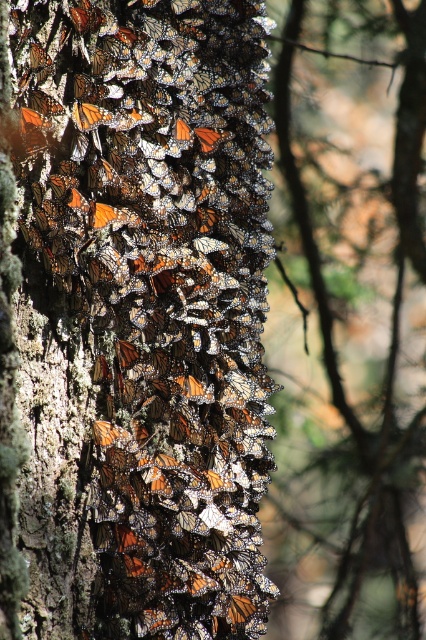
You are observing a cluster of monarch butterflies on a tree trunk. There is a point labeled as point (141,314). Which object corresponds to this point?

The orange and black wings at center corresponds to point (141,314).